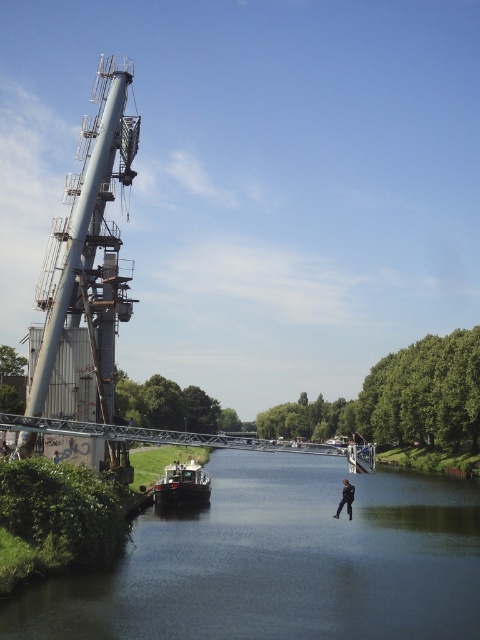
You are standing at the point marked by the coordinates point [280,563]. What is the color of the surface you are currently standing on?

The dark blue water at center is represented by point [280,563], so you are standing on dark blue water at center.

You are standing at the point labeled point at (x=394, y=620). You want to reach the opposite bank. The walkway is 62.30 meters long. Can you walk directly to the opposite bank without any obstacles?

The walkway from the point at (x=394, y=620) to the opposite bank is 62.30 meters long. Since there are no mentioned obstacles in the scene description, you can walk directly to the opposite bank without any issues.